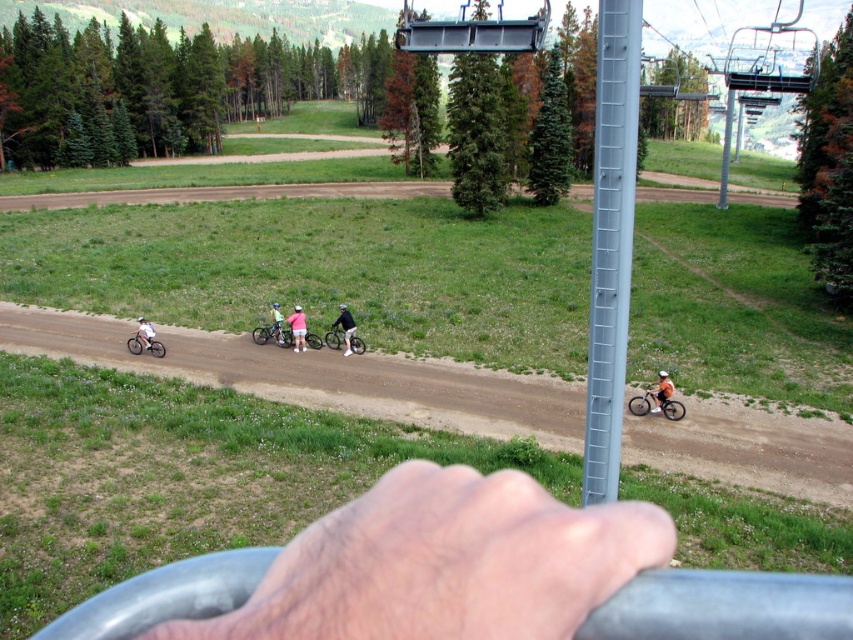
Question: Considering the relative positions of orange matte dirt bike at lower right and matte black bicycle at center in the image provided, where is orange matte dirt bike at lower right located with respect to matte black bicycle at center?

Choices:
 (A) above
 (B) below

Answer: (B)

Question: Is light blue fabric helmet at lower right above light pink fabric shorts at center?

Choices:
 (A) yes
 (B) no

Answer: (B)

Question: Which of the following is the farthest from the observer?

Choices:
 (A) (276, 316)
 (B) (334, 328)
 (C) (645, 413)

Answer: (A)

Question: Which of the following is the farthest from the observer?

Choices:
 (A) (155, 342)
 (B) (354, 342)
 (C) (602, 54)

Answer: (A)

Question: Can you confirm if matte black dirt bike at left is thinner than white matte helmet at center?

Choices:
 (A) yes
 (B) no

Answer: (B)

Question: Which point is farther to the camera?

Choices:
 (A) pink fabric shirt at center
 (B) light pink fabric shorts at center

Answer: (A)